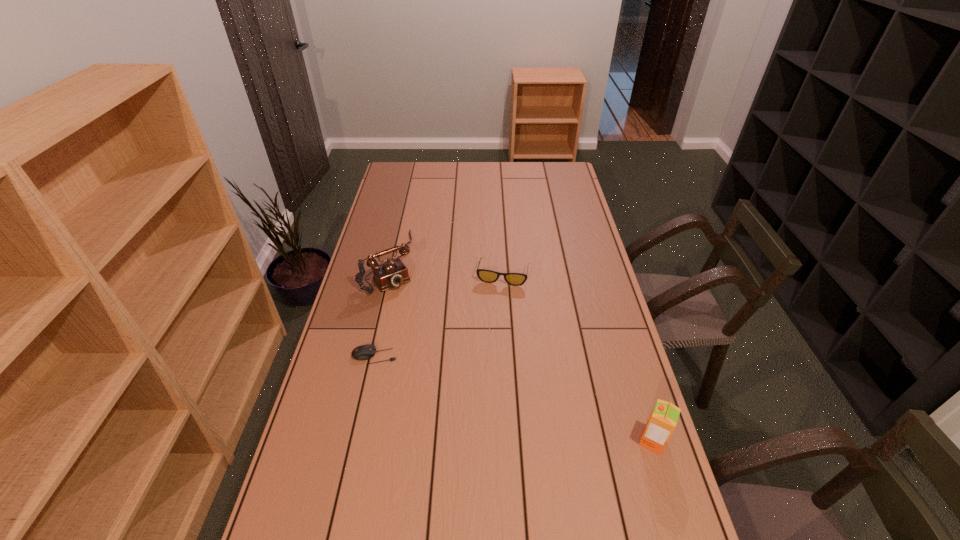
You are a GUI agent. You are given a task and a screenshot of the screen. Output one action in this format:
    pyautogui.click(x=<x>, y=<y>)
    Task: Click on the vacant space that is in between the second shortest object and the telephone
    The width and height of the screenshot is (960, 540).
    Given the screenshot: What is the action you would take?
    pyautogui.click(x=446, y=268)

I want to click on empty space between the third tallest object and the mouse, so click(439, 315).

You are a GUI agent. You are given a task and a screenshot of the screen. Output one action in this format:
    pyautogui.click(x=<x>, y=<y>)
    Task: Click on the vacant point located between the telephone and the sunglasses
    The width and height of the screenshot is (960, 540).
    Given the screenshot: What is the action you would take?
    pyautogui.click(x=446, y=268)

Where is `unoccupied position between the orange juice and the shortest object`? The height and width of the screenshot is (540, 960). unoccupied position between the orange juice and the shortest object is located at coordinates (514, 399).

The width and height of the screenshot is (960, 540). Identify the location of unoccupied position between the mouse and the telephone. (382, 309).

Identify the location of the closest object to the rightmost object. The height and width of the screenshot is (540, 960). (516, 279).

Locate an element on the screen. the second closest object to the telephone is located at coordinates point(516,279).